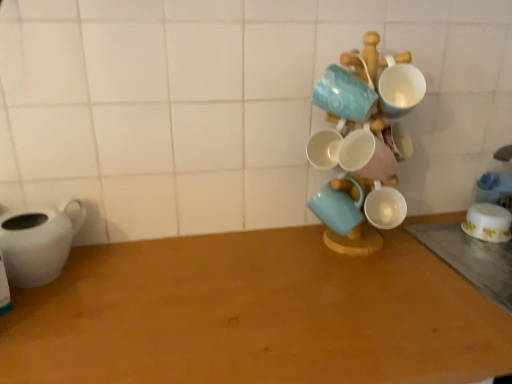
Question: From a real-world perspective, is white glossy mugs at center-right on white matte teapot at left?

Choices:
 (A) yes
 (B) no

Answer: (A)

Question: Can you confirm if white glossy mugs at center-right is bigger than white matte teapot at left?

Choices:
 (A) no
 (B) yes

Answer: (B)

Question: Could you tell me if white glossy mugs at center-right is facing white matte teapot at left?

Choices:
 (A) yes
 (B) no

Answer: (B)

Question: Can you confirm if white glossy mugs at center-right is taller than white matte teapot at left?

Choices:
 (A) yes
 (B) no

Answer: (A)

Question: Does white glossy mugs at center-right appear on the left side of white matte teapot at left?

Choices:
 (A) yes
 (B) no

Answer: (B)

Question: Considering their positions, is white glossy mugs at center-right located in front of or behind matte ceramic mug at center, the 1th coffee cup when ordered from left to right?

Choices:
 (A) front
 (B) behind

Answer: (A)

Question: From the image's perspective, is white glossy mugs at center-right located above or below matte ceramic mug at center, which ranks as the 2th coffee cup in right-to-left order?

Choices:
 (A) above
 (B) below

Answer: (A)

Question: Would you say white glossy mugs at center-right is to the left or to the right of matte ceramic mug at center, the first coffee cup viewed from the front, in the picture?

Choices:
 (A) right
 (B) left

Answer: (A)

Question: Considering the positions of point (334, 188) and point (309, 208), is point (334, 188) closer or farther from the camera than point (309, 208)?

Choices:
 (A) closer
 (B) farther

Answer: (A)

Question: In terms of height, does wooden table at center, positioned as the 1th table in left-to-right order, look taller or shorter compared to wooden table at lower right, placed as the 1th table when sorted from right to left?

Choices:
 (A) short
 (B) tall

Answer: (A)

Question: Does point (129, 243) appear closer or farther from the camera than point (463, 258)?

Choices:
 (A) closer
 (B) farther

Answer: (A)

Question: From the image's perspective, is wooden table at center, positioned as the 2th table in right-to-left order, located above or below wooden table at lower right, placed as the 1th table when sorted from right to left?

Choices:
 (A) above
 (B) below

Answer: (A)

Question: Looking at the image, does wooden table at center, positioned as the 2th table in right-to-left order, seem bigger or smaller compared to wooden table at lower right, placed as the second table when sorted from left to right?

Choices:
 (A) small
 (B) big

Answer: (A)

Question: In terms of width, does white matte teapot at left look wider or thinner when compared to white glossy mugs at center-right?

Choices:
 (A) thin
 (B) wide

Answer: (B)

Question: In terms of height, does white matte teapot at left look taller or shorter compared to white glossy mugs at center-right?

Choices:
 (A) tall
 (B) short

Answer: (B)